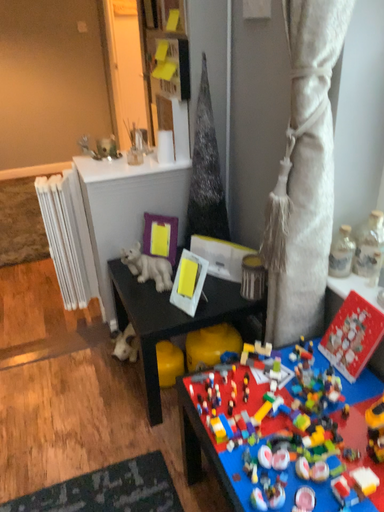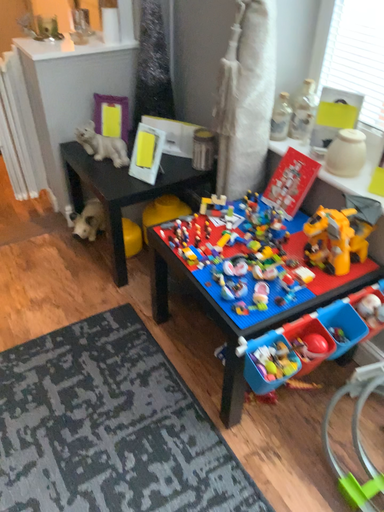
Question: Which way did the camera rotate in the video?

Choices:
 (A) rotated left
 (B) rotated right

Answer: (B)